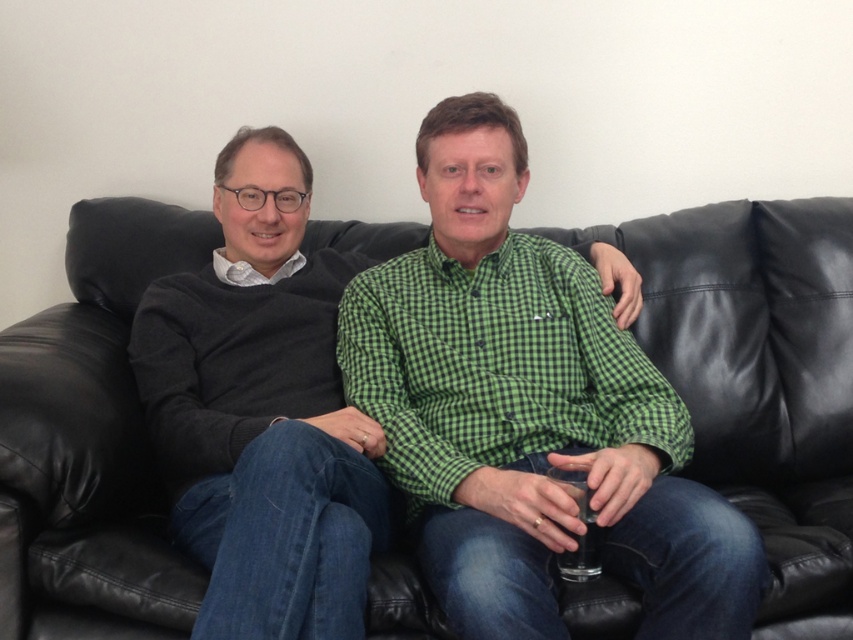
Question: Where is black leather couch at center located in relation to white matte shirt at left in the image?

Choices:
 (A) left
 (B) right

Answer: (A)

Question: Which of the following is the farthest from the observer?

Choices:
 (A) (590, 605)
 (B) (216, 269)
 (C) (268, 429)

Answer: (B)

Question: Is black leather couch at center to the left of green checkered shirt at center from the viewer's perspective?

Choices:
 (A) no
 (B) yes

Answer: (B)

Question: Can you confirm if green checkered shirt at center is smaller than dark gray sweater at left?

Choices:
 (A) no
 (B) yes

Answer: (B)

Question: Which point is closer to the camera?

Choices:
 (A) dark gray sweater at left
 (B) white matte shirt at left

Answer: (A)

Question: Which point is closer to the camera?

Choices:
 (A) dark gray sweater at left
 (B) white matte shirt at left
 (C) black leather couch at center
 (D) green checkered shirt at center

Answer: (A)